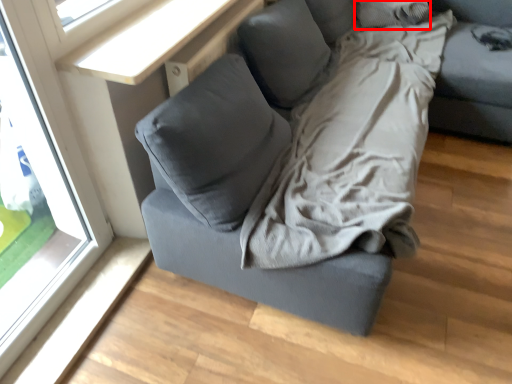
Question: Where is pillow (annotated by the red box) located in relation to window in the image?

Choices:
 (A) right
 (B) left

Answer: (A)